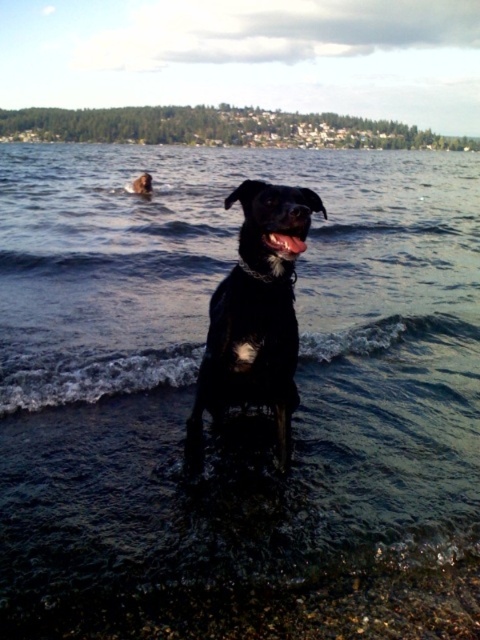
Question: Considering the relative positions of smooth pebbles at lower center and shiny black dog at center in the image provided, where is smooth pebbles at lower center located with respect to shiny black dog at center?

Choices:
 (A) left
 (B) right

Answer: (B)

Question: Among these points, which one is farthest from the camera?

Choices:
 (A) (113, 634)
 (B) (290, 397)

Answer: (B)

Question: Among these objects, which one is farthest from the camera?

Choices:
 (A) smooth pebbles at lower center
 (B) shiny black dog at center

Answer: (B)

Question: Is smooth pebbles at lower center to the left of shiny black dog at center from the viewer's perspective?

Choices:
 (A) yes
 (B) no

Answer: (B)

Question: Which point appears closest to the camera in this image?

Choices:
 (A) coord(391,573)
 (B) coord(211,384)

Answer: (A)

Question: Does smooth pebbles at lower center have a larger size compared to shiny black dog at center?

Choices:
 (A) yes
 (B) no

Answer: (B)